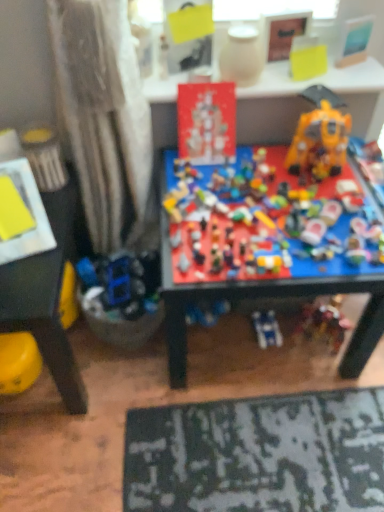
Question: Is matte white vase at upper center, placed as the 3th toy when sorted from left to right, wider than red cardboard sign at upper center, the 1th table in the top-to-bottom sequence?

Choices:
 (A) no
 (B) yes

Answer: (A)

Question: From the image's perspective, is matte white vase at upper center, the 4th toy positioned from the right, under red cardboard sign at upper center, the 2th table from the left?

Choices:
 (A) yes
 (B) no

Answer: (B)

Question: Could you tell me if matte white vase at upper center, placed as the 3th toy when sorted from left to right, is turned towards red cardboard sign at upper center, the 1th table in the top-to-bottom sequence?

Choices:
 (A) no
 (B) yes

Answer: (A)

Question: From a real-world perspective, does matte white vase at upper center, placed as the 3th toy when sorted from left to right, sit lower than red cardboard sign at upper center, the 2th table from the left?

Choices:
 (A) yes
 (B) no

Answer: (B)

Question: Is matte white vase at upper center, the 4th toy positioned from the right, facing away from red cardboard sign at upper center, which ranks as the second table in bottom-to-top order?

Choices:
 (A) yes
 (B) no

Answer: (B)

Question: From a real-world perspective, is matte white curtain at left located higher than matte white vase at upper center, the 4th toy positioned from the right?

Choices:
 (A) no
 (B) yes

Answer: (A)

Question: Considering the relative sizes of matte white curtain at left and matte white vase at upper center, placed as the 3th toy when sorted from left to right, in the image provided, is matte white curtain at left bigger than matte white vase at upper center, placed as the 3th toy when sorted from left to right,?

Choices:
 (A) no
 (B) yes

Answer: (B)

Question: Is matte white curtain at left positioned in front of matte white vase at upper center, placed as the 3th toy when sorted from left to right?

Choices:
 (A) yes
 (B) no

Answer: (A)

Question: Is matte white curtain at left oriented towards matte white vase at upper center, placed as the 3th toy when sorted from left to right?

Choices:
 (A) yes
 (B) no

Answer: (B)

Question: Considering the relative sizes of matte white curtain at left and matte white vase at upper center, placed as the 3th toy when sorted from left to right, in the image provided, is matte white curtain at left wider than matte white vase at upper center, placed as the 3th toy when sorted from left to right,?

Choices:
 (A) yes
 (B) no

Answer: (A)

Question: Does matte white curtain at left have a lesser width compared to matte white vase at upper center, the 4th toy positioned from the right?

Choices:
 (A) no
 (B) yes

Answer: (A)

Question: Is multicolored plastic toys at center, which appears as the fourth toy when viewed from the left, at the right side of yellow matte paper at upper center, placed as the second toy when sorted from right to left?

Choices:
 (A) no
 (B) yes

Answer: (A)